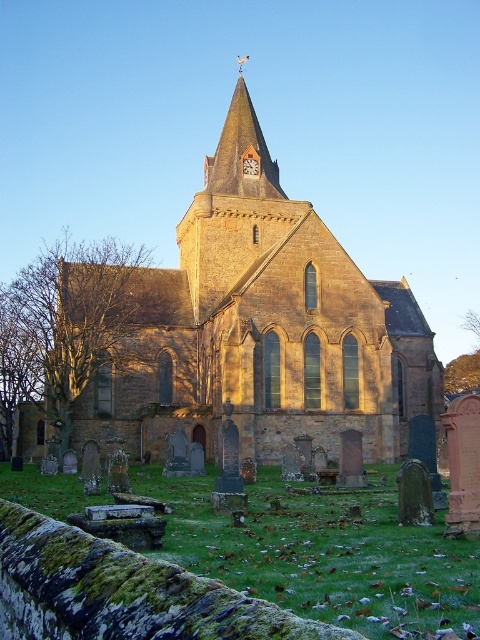
You are a visitor standing in front of the brown stone church at center and the matte brown clock at center. Which object would appear larger to you?

The brown stone church at center is bigger than the matte brown clock at center, so the brown stone church at center would appear larger.

You are standing in front of the brown stone church at center and looking towards the brown stone spire at upper center. Which object appears larger in your view?

The brown stone church at center appears larger than the brown stone spire at upper center because it is bigger in size.